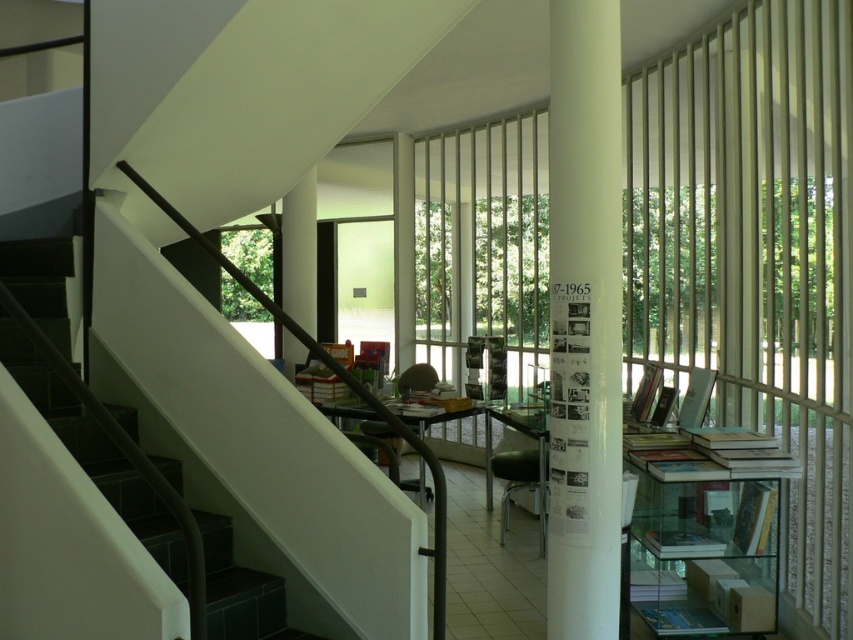
You are standing at the entrance of the modern indoor space and want to place a 10 feet long ladder between the white glossy stairwell at left and the hardcover book at center. Is there enough space to place the ladder horizontally between them?

The distance between the white glossy stairwell at left and the hardcover book at center is 8.78 feet, which is shorter than the 10 feet ladder. Therefore, the ladder cannot be placed horizontally between them.

Consider the image. You are standing at the entrance of the modern indoor space and see the point marked at coordinates (584, 321). What object is this point located on?

The point marked at coordinates (584, 321) is located on the white glossy pillar at center.

You are standing in the modern indoor space and want to take a photo of the white glossy pillar at center. If your camera has a maximum focus range of 10 feet, will you need to move closer to the pillar to capture it clearly?

The white glossy pillar at center is 11.42 feet away from the camera, which exceeds the maximum focus range of 10 feet. Therefore, you need to move closer to the pillar to ensure it is in focus.